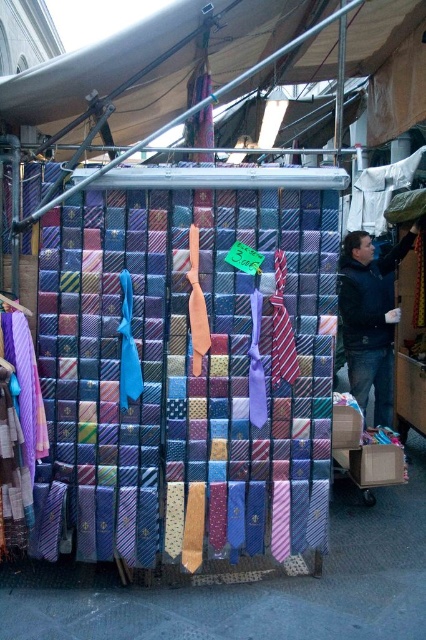
Question: Considering the relative positions of textured silk tie at center and matte purple tie at left in the image provided, where is textured silk tie at center located with respect to matte purple tie at left?

Choices:
 (A) left
 (B) right

Answer: (B)

Question: Does textured silk tie at center appear on the right side of dark blue jacket at center?

Choices:
 (A) no
 (B) yes

Answer: (A)

Question: Is textured silk tie at center closer to the viewer compared to dark blue jacket at center?

Choices:
 (A) yes
 (B) no

Answer: (A)

Question: Which object is positioned farthest from the dark blue jacket at center?

Choices:
 (A) matte purple tie at left
 (B) beige fabric canopy at upper center

Answer: (A)

Question: Among these objects, which one is nearest to the camera?

Choices:
 (A) matte purple tie at left
 (B) textured silk tie at center
 (C) dark blue jacket at center
 (D) beige fabric canopy at upper center

Answer: (D)

Question: Which of the following is the farthest from the observer?

Choices:
 (A) (19, 305)
 (B) (186, 1)
 (C) (353, 291)
 (D) (294, 470)

Answer: (C)